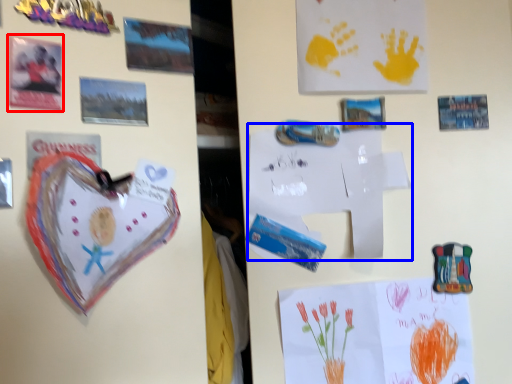
Question: Which object is further to the camera taking this photo, postcard (highlighted by a red box) or paper (highlighted by a blue box)?

Choices:
 (A) postcard
 (B) paper

Answer: (B)